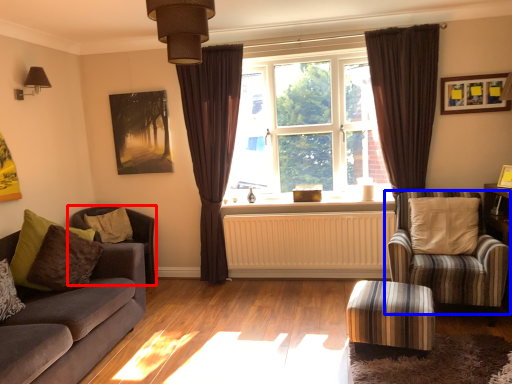
Question: Which of the following is the farthest to the observer, chair (highlighted by a red box) or chair (highlighted by a blue box)?

Choices:
 (A) chair
 (B) chair

Answer: (A)